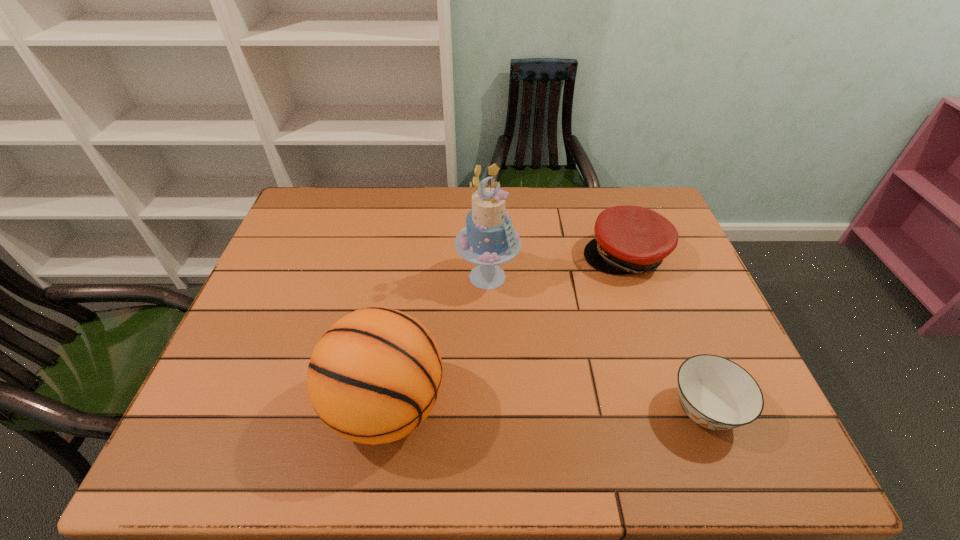
The height and width of the screenshot is (540, 960). Identify the location of vacant region located 0.240m with a ladder on the side of the tallest object. (554, 362).

Identify the location of free region located 0.090m at the front of the third tallest object where the visor is located. [592, 296].

You are a GUI agent. You are given a task and a screenshot of the screen. Output one action in this format:
    pyautogui.click(x=<x>, y=<y>)
    Task: Click on the free space located 0.260m at the front of the third tallest object where the visor is located
    This screenshot has height=540, width=960.
    Given the screenshot: What is the action you would take?
    pyautogui.click(x=561, y=336)

I want to click on vacant space situated at the front of the third tallest object where the visor is located, so click(x=546, y=355).

I want to click on basketball at the near edge, so click(374, 376).

Where is `soup bowl that is at the near edge`? soup bowl that is at the near edge is located at coordinates click(x=716, y=393).

Where is `soup bowl that is at the right edge`? This screenshot has width=960, height=540. soup bowl that is at the right edge is located at coordinates (716, 393).

What are the coordinates of `cap present at the right edge` in the screenshot? It's located at (628, 239).

At what (x,y) coordinates should I click in order to perform the action: click on object present at the near right corner. Please return your answer as a coordinate pair (x, y). The width and height of the screenshot is (960, 540). Looking at the image, I should click on (716, 393).

The height and width of the screenshot is (540, 960). In order to click on blank space at the far edge of the desktop in this screenshot , I will do `click(342, 225)`.